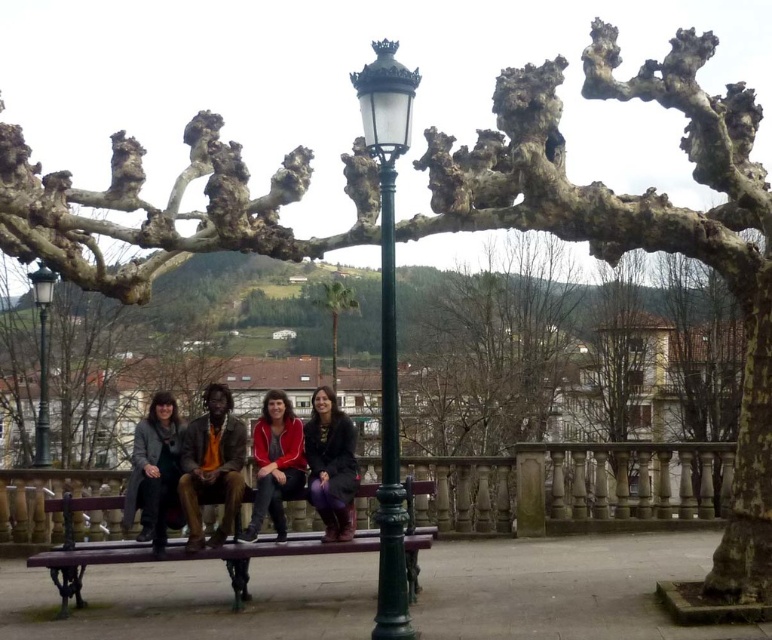
Is matte black jacket at center bigger than dark gray coat at left?

Incorrect, matte black jacket at center is not larger than dark gray coat at left.

Find the location of a particular element. This screenshot has width=772, height=640. matte black jacket at center is located at coordinates (330, 465).

Who is more distant from viewer, (334, 524) or (151, 419)?

The point (151, 419) is behind.

Locate an element on the screen. The image size is (772, 640). matte black jacket at center is located at coordinates (330, 465).

Which is below, red jacket at center or green leafy palm tree at center?

Positioned lower is red jacket at center.

Between point (245, 536) and point (334, 301), which one is positioned in front?

Positioned in front is point (245, 536).

In order to click on red jacket at center in this screenshot , I will do `click(276, 464)`.

Can you confirm if wooden bench at center is bigger than matte black jacket at center?

Indeed, wooden bench at center has a larger size compared to matte black jacket at center.

Describe the element at coordinates (168, 552) in the screenshot. This screenshot has width=772, height=640. I see `wooden bench at center` at that location.

You are a GUI agent. You are given a task and a screenshot of the screen. Output one action in this format:
    pyautogui.click(x=<x>, y=<y>)
    Task: Click on the wooden bench at center
    
    Given the screenshot: What is the action you would take?
    pyautogui.click(x=168, y=552)